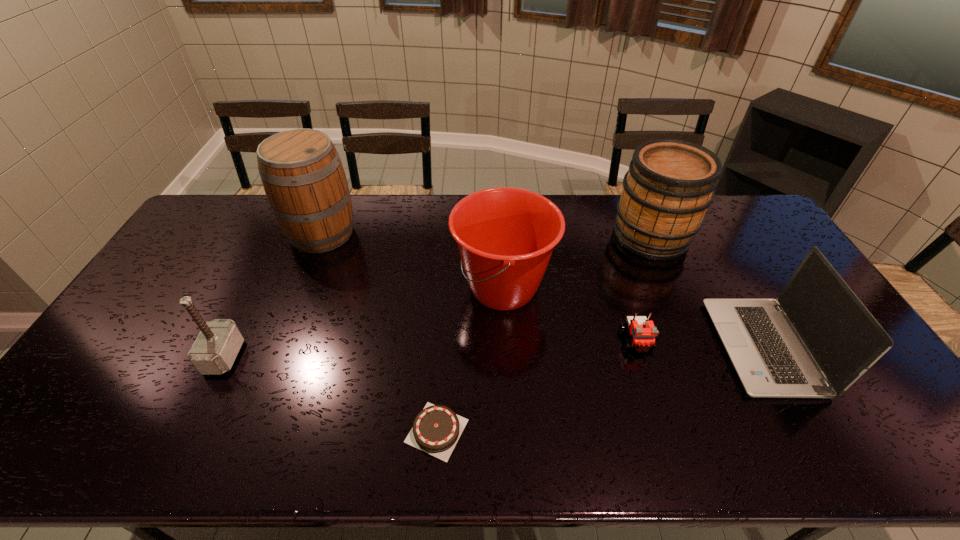
Find the location of `free space located 0.370m with the handle attached to the rim of the bucket`. free space located 0.370m with the handle attached to the rim of the bucket is located at coordinates pos(333,288).

At what (x,y) coordinates should I click in order to perform the action: click on free location located 0.350m with the handle attached to the rim of the bucket. Please return your answer as a coordinate pair (x, y). This screenshot has height=540, width=960. Looking at the image, I should click on (340, 288).

You are a GUI agent. You are given a task and a screenshot of the screen. Output one action in this format:
    pyautogui.click(x=<x>, y=<y>)
    Task: Click on the vacant region located with the handle attached to the rim of the bucket
    
    Given the screenshot: What is the action you would take?
    pyautogui.click(x=369, y=288)

The height and width of the screenshot is (540, 960). Find the location of `free space located on the screen of the laptop computer`. free space located on the screen of the laptop computer is located at coordinates (641, 347).

Identify the location of vacant space situated 0.320m on the screen of the laptop computer. The height and width of the screenshot is (540, 960). (605, 347).

Find the location of a particular element. The width and height of the screenshot is (960, 540). vacant space located on the screen of the laptop computer is located at coordinates (626, 347).

I want to click on vacant region located 0.100m for striking with the head of the hammer, so click(276, 356).

At what (x,y) coordinates should I click in order to perform the action: click on vacant area situated on the front-facing side of the sixth tallest object. Please return your answer as a coordinate pair (x, y). Looking at the image, I should click on (654, 400).

Where is `vacant space located 0.250m on the back of the shortest object`? vacant space located 0.250m on the back of the shortest object is located at coordinates (444, 323).

Where is `object present at the near edge`? Image resolution: width=960 pixels, height=540 pixels. object present at the near edge is located at coordinates (436, 429).